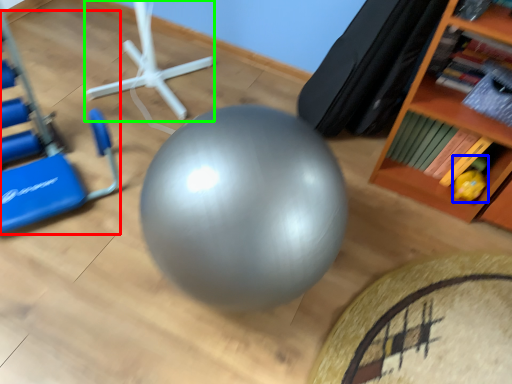
Question: Which object is positioned closest to swivel chair (highlighted by a red box)? Select from toy (highlighted by a blue box) and sport equipment (highlighted by a green box).

Choices:
 (A) toy
 (B) sport equipment

Answer: (B)